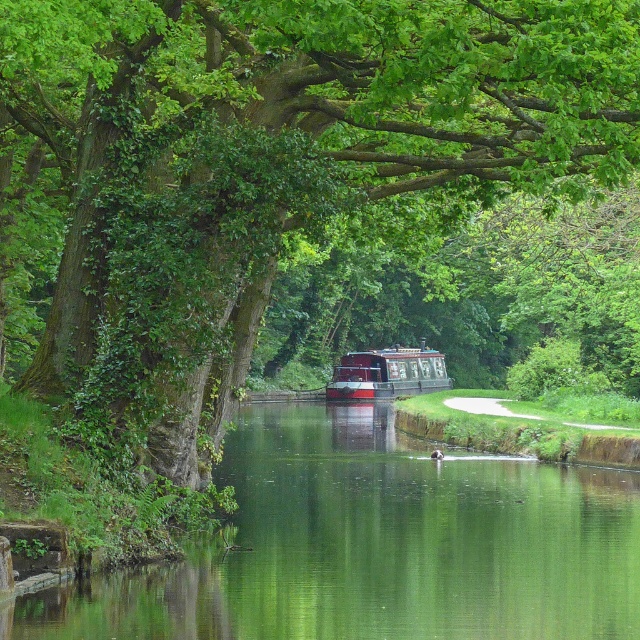
Question: Among these points, which one is nearest to the camera?

Choices:
 (A) (422, 388)
 (B) (557, 636)

Answer: (B)

Question: Can you confirm if green smooth water at center is smaller than polished wood boat at center?

Choices:
 (A) yes
 (B) no

Answer: (B)

Question: Is green smooth water at center closer to camera compared to polished wood boat at center?

Choices:
 (A) no
 (B) yes

Answer: (B)

Question: Can you confirm if green smooth water at center is positioned to the left of polished wood boat at center?

Choices:
 (A) no
 (B) yes

Answer: (B)

Question: Which point appears closest to the camera in this image?

Choices:
 (A) (388, 348)
 (B) (339, 515)

Answer: (B)